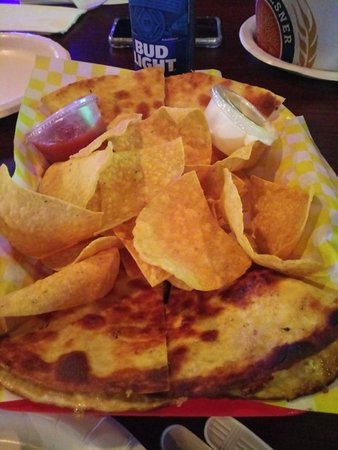
Locate an element on the screen. This screenshot has height=450, width=338. sauce cups is located at coordinates (210, 113), (72, 125).